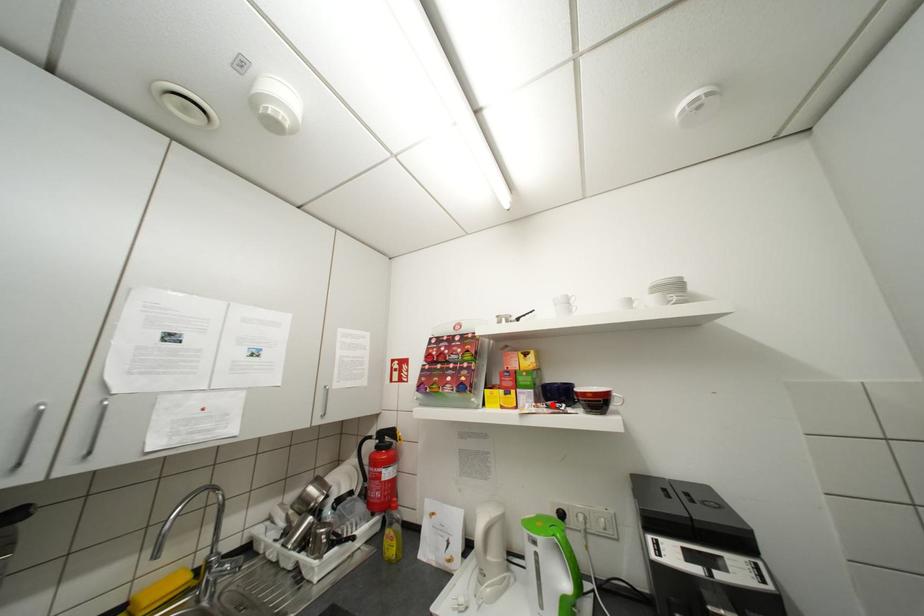
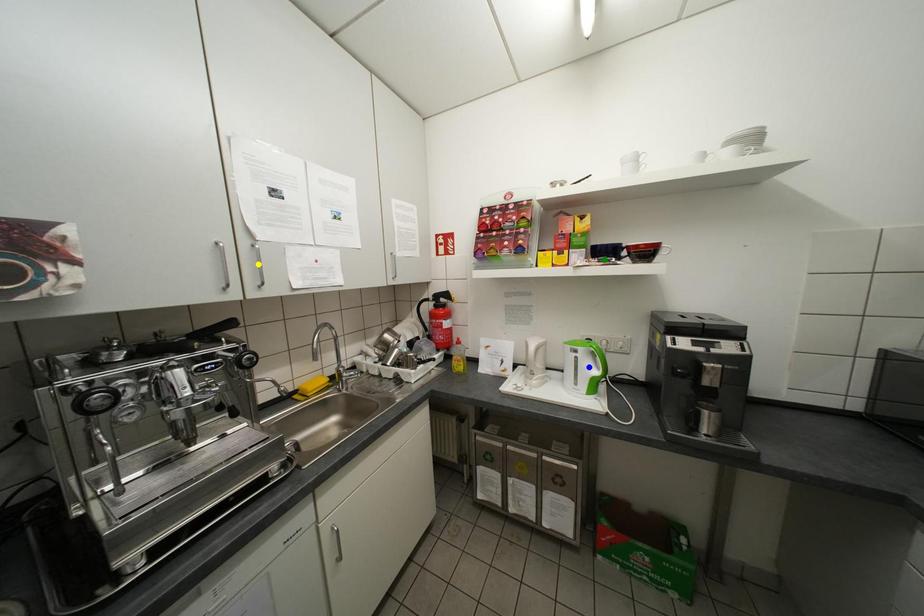
Question: I am providing you with two images of the same scene from different viewpoints. A red point is marked on the first image. You are given multiple points on the second image. Which spot in image 2 lines up with the point in image 1?

Choices:
 (A) blue point
 (B) yellow point
 (C) green point

Answer: (C)